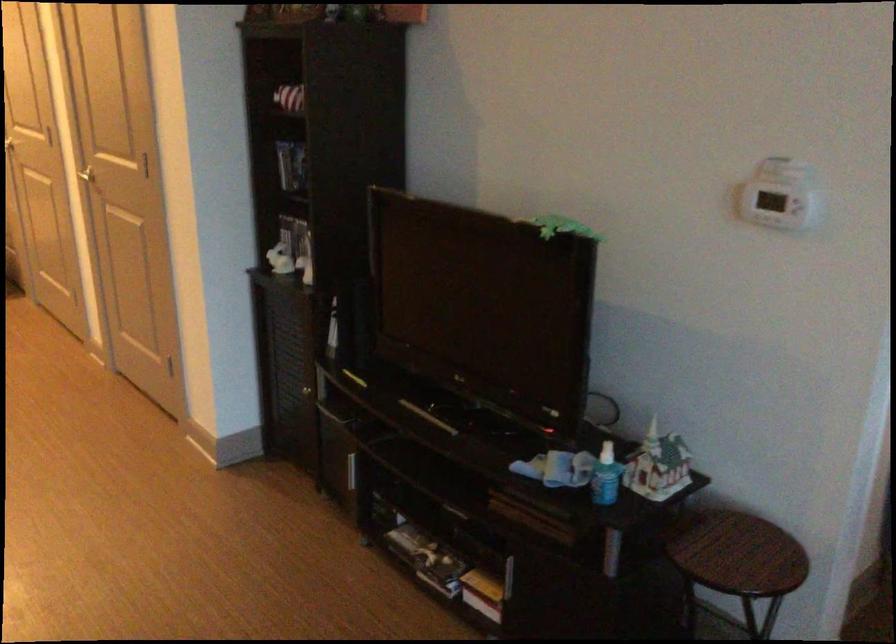
The location [606,476] corresponds to which object?

This point indicates the blue spray bottle.